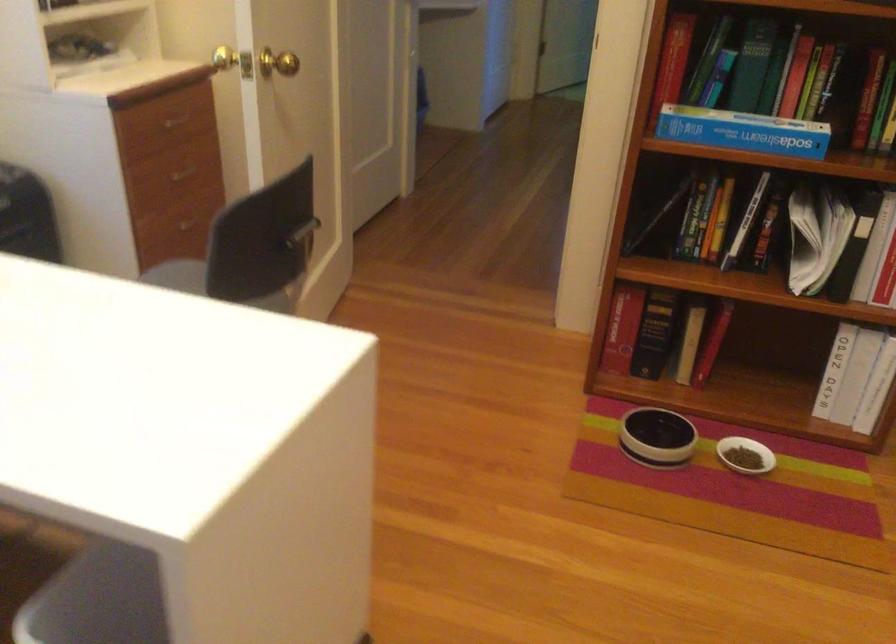
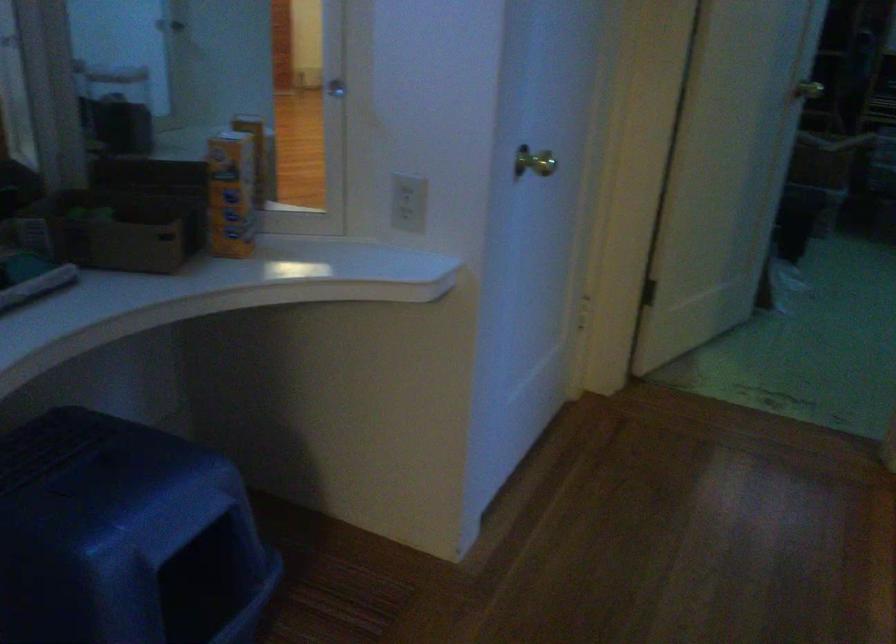
Question: What movement of the cameraman would produce the second image?

Choices:
 (A) Left
 (B) Right
 (C) Forward
 (D) Backward

Answer: (C)